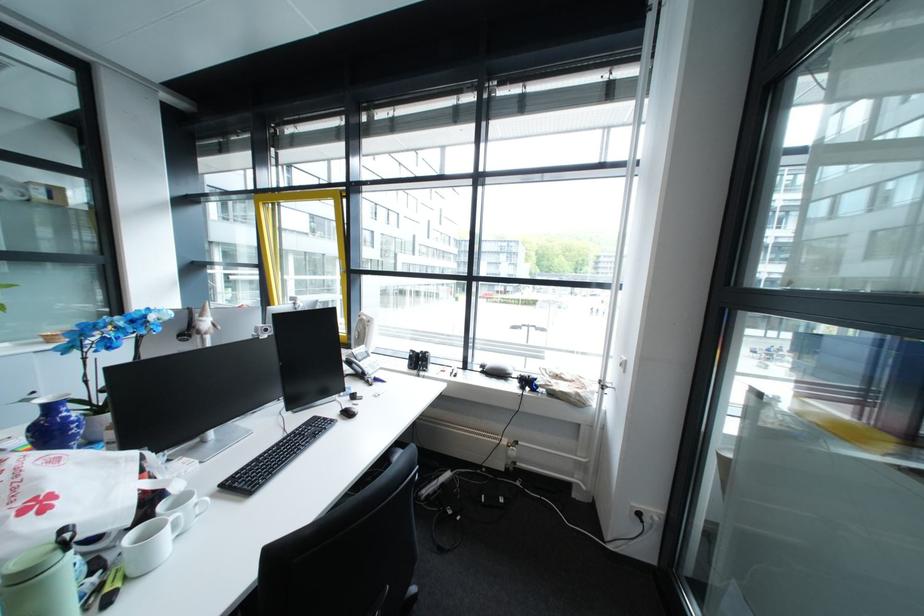
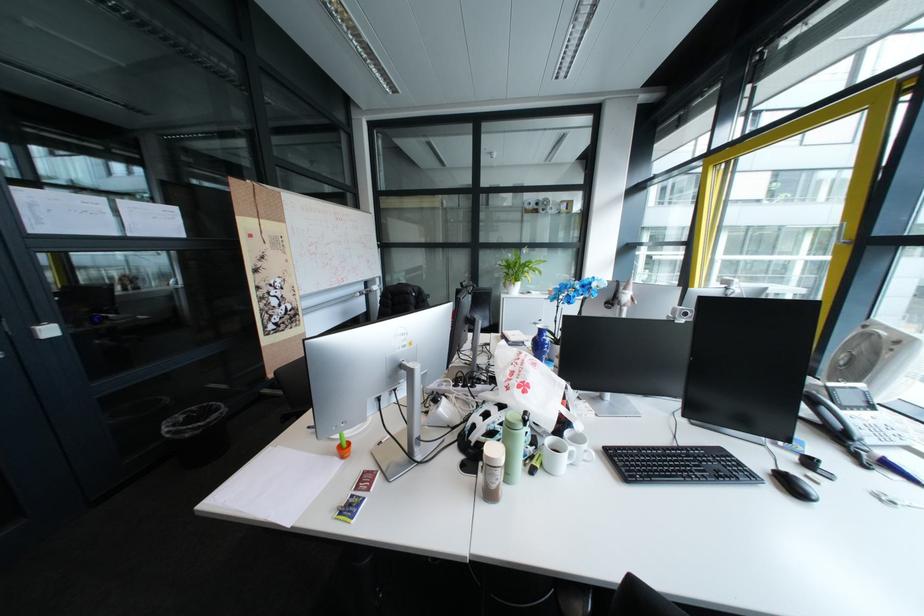
Where in the second image is the point corresponding to point 368,365 from the first image?

(837, 408)